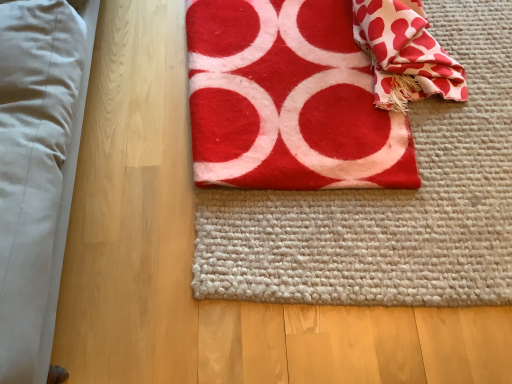
At what (x,y) coordinates should I click in order to perform the action: click on vacant space in red felt yoga mat at center (from a real-world perspective). Please return your answer as a coordinate pair (x, y). Looking at the image, I should click on (410, 190).